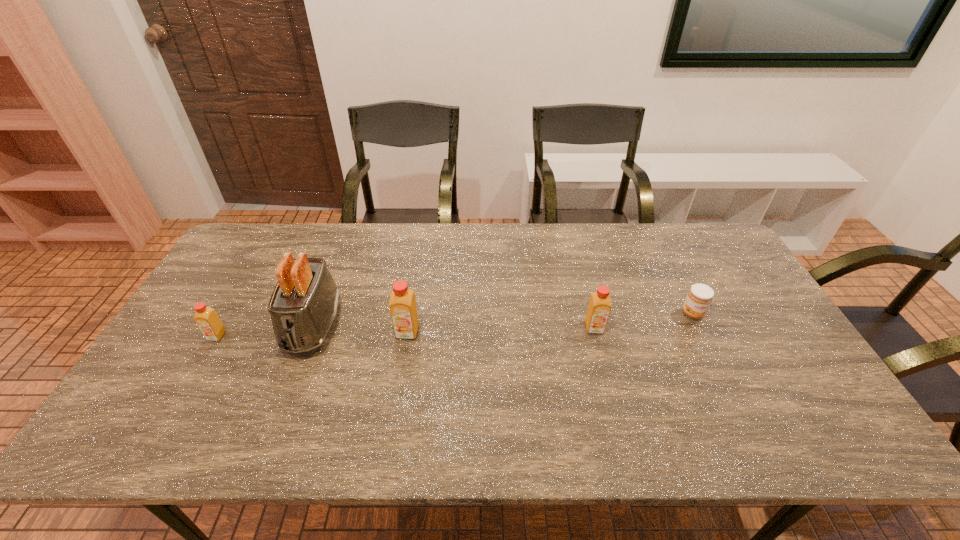
This screenshot has height=540, width=960. In order to click on the shortest orange juice in this screenshot , I will do `click(206, 318)`.

Locate an element on the screen. Image resolution: width=960 pixels, height=540 pixels. the leftmost object is located at coordinates (206, 318).

The image size is (960, 540). Find the location of `the second orange juice from left to right`. the second orange juice from left to right is located at coordinates (403, 310).

This screenshot has width=960, height=540. I want to click on the tallest orange juice, so click(403, 310).

This screenshot has height=540, width=960. Identify the location of the second object from right to left. (599, 308).

Image resolution: width=960 pixels, height=540 pixels. I want to click on the rightmost orange juice, so click(x=599, y=308).

Locate an element on the screen. toaster is located at coordinates (303, 306).

Find the location of a particular element. This screenshot has width=960, height=540. the tallest object is located at coordinates (303, 306).

Locate an element on the screen. The width and height of the screenshot is (960, 540). the rightmost object is located at coordinates (699, 297).

The height and width of the screenshot is (540, 960). I want to click on jam, so click(x=699, y=297).